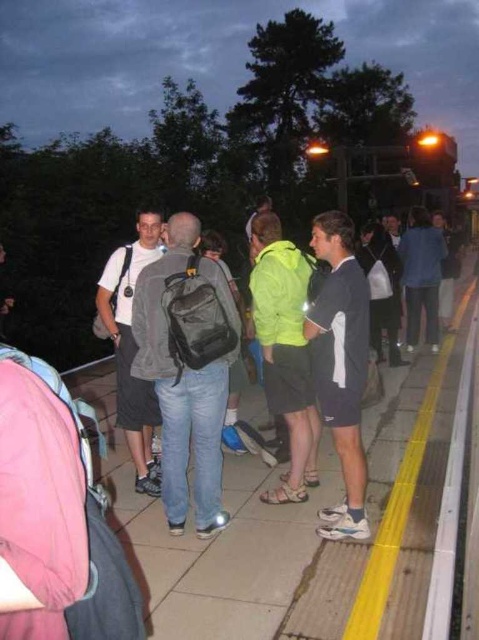
Question: Can you confirm if dark blue jersey at center is bigger than white fabric line at right?

Choices:
 (A) no
 (B) yes

Answer: (A)

Question: Which of the following is the farthest from the observer?

Choices:
 (A) matte gray pavement at center
 (B) matte black backpack at center

Answer: (B)

Question: Can you confirm if dark blue jersey at center is positioned above white fabric line at right?

Choices:
 (A) yes
 (B) no

Answer: (A)

Question: Which of the following is the farthest from the observer?

Choices:
 (A) (310, 406)
 (B) (442, 374)

Answer: (B)

Question: Which of these objects is positioned closest to the matte gray pavement at center?

Choices:
 (A) white matte t-shirt at center
 (B) dark blue jersey at center
 (C) white fabric line at right
 (D) neon green fabric jacket at center

Answer: (B)

Question: Does matte gray pavement at center appear on the left side of neon green fabric jacket at center?

Choices:
 (A) no
 (B) yes

Answer: (B)